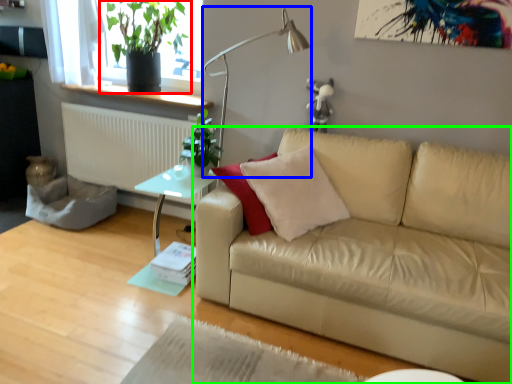
Question: Based on their relative distances, which object is nearer to houseplant (highlighted by a red box)? Choose from table lamp (highlighted by a blue box) and studio couch (highlighted by a green box).

Choices:
 (A) table lamp
 (B) studio couch

Answer: (A)